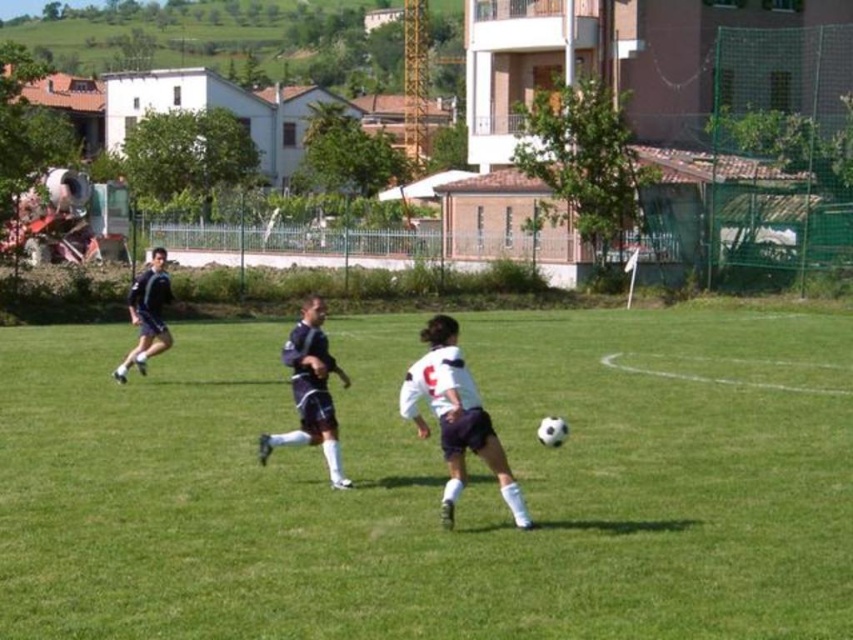
Is point (456, 484) closer to camera compared to point (135, 285)?

Yes, it is.

Consider the image. Is white matte jersey at center bigger than dark blue jersey at left?

Actually, white matte jersey at center might be smaller than dark blue jersey at left.

Describe the element at coordinates (456, 417) in the screenshot. I see `white matte jersey at center` at that location.

Image resolution: width=853 pixels, height=640 pixels. Find the location of `white matte jersey at center`. white matte jersey at center is located at coordinates (456, 417).

Can you confirm if dark blue jersey at center is smaller than dark blue jersey at left?

Yes, dark blue jersey at center is smaller than dark blue jersey at left.

Is dark blue jersey at center shorter than dark blue jersey at left?

Correct, dark blue jersey at center is not as tall as dark blue jersey at left.

Is point (305, 339) positioned after point (120, 368)?

That is False.

In order to click on dark blue jersey at center in this screenshot , I will do `click(310, 392)`.

Can you confirm if green grass at center is taller than dark blue jersey at left?

No, green grass at center is not taller than dark blue jersey at left.

Is green grass at center bigger than dark blue jersey at left?

Yes.

Find the location of `green grass at center`. green grass at center is located at coordinates (434, 484).